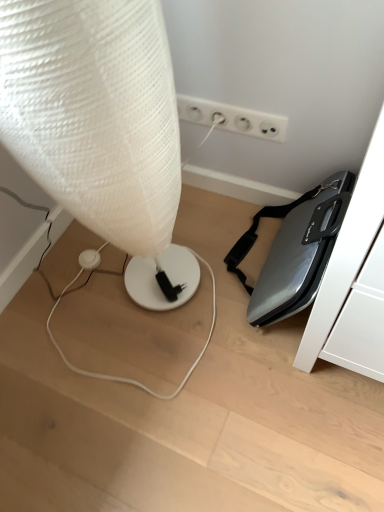
Question: Should I look upward or downward to see white textured lamp at left?

Choices:
 (A) up
 (B) down

Answer: (A)

Question: From the image's perspective, is white textured lamp at left located above white plastic electrical outlet at upper center?

Choices:
 (A) no
 (B) yes

Answer: (A)

Question: Considering the relative sizes of white textured lamp at left and white plastic electrical outlet at upper center in the image provided, is white textured lamp at left taller than white plastic electrical outlet at upper center?

Choices:
 (A) yes
 (B) no

Answer: (A)

Question: Is white textured lamp at left oriented towards white plastic electrical outlet at upper center?

Choices:
 (A) yes
 (B) no

Answer: (B)

Question: Is white plastic electrical outlet at upper center inside white textured lamp at left?

Choices:
 (A) no
 (B) yes

Answer: (A)

Question: Is white textured lamp at left wider than white plastic electrical outlet at upper center?

Choices:
 (A) yes
 (B) no

Answer: (A)

Question: Would you consider white textured lamp at left to be distant from white plastic electrical outlet at upper center?

Choices:
 (A) no
 (B) yes

Answer: (A)

Question: Is white plastic electrical outlet at upper center surrounding white textured lamp at left?

Choices:
 (A) yes
 (B) no

Answer: (B)

Question: Is white plastic electrical outlet at upper center bigger than white textured lamp at left?

Choices:
 (A) no
 (B) yes

Answer: (A)

Question: Can you confirm if white plastic electrical outlet at upper center is taller than white textured lamp at left?

Choices:
 (A) yes
 (B) no

Answer: (B)

Question: Are white plastic electrical outlet at upper center and white textured lamp at left making contact?

Choices:
 (A) yes
 (B) no

Answer: (B)

Question: Is white plastic electrical outlet at upper center oriented towards white textured lamp at left?

Choices:
 (A) yes
 (B) no

Answer: (A)

Question: Is white plastic electrical outlet at upper center positioned before white textured lamp at left?

Choices:
 (A) yes
 (B) no

Answer: (B)

Question: From their relative heights in the image, would you say white textured lamp at left is taller or shorter than white plastic electrical outlet at upper center?

Choices:
 (A) short
 (B) tall

Answer: (B)